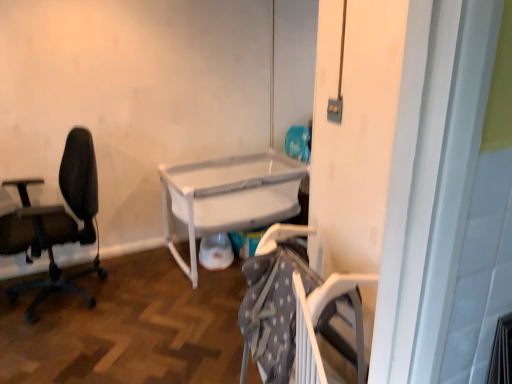
The image size is (512, 384). In order to click on vacant area that lies in front of black mesh office chair at left in this screenshot , I will do `click(55, 352)`.